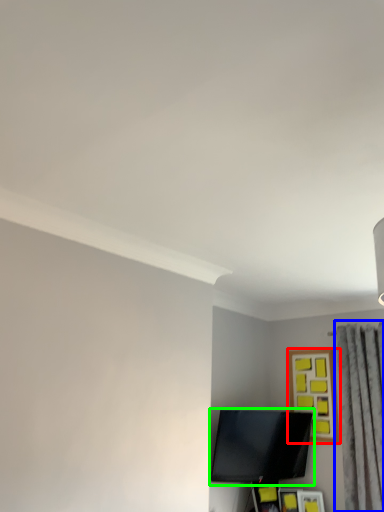
Question: Which object is positioned farthest from picture frame (highlighted by a red box)? Select from curtain (highlighted by a blue box) and television (highlighted by a green box).

Choices:
 (A) curtain
 (B) television

Answer: (B)